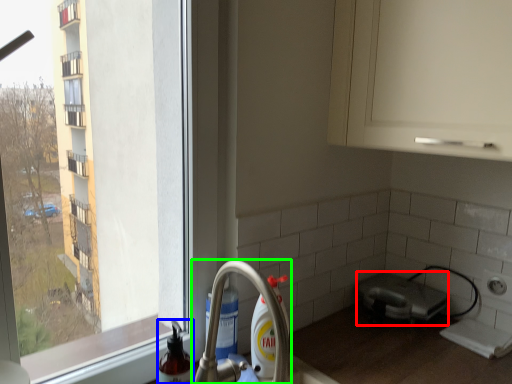
Question: Which object is positioned closest to appliance (highlighted by a red box)? Select from cleaning product (highlighted by a blue box) and tap (highlighted by a green box).

Choices:
 (A) cleaning product
 (B) tap

Answer: (B)